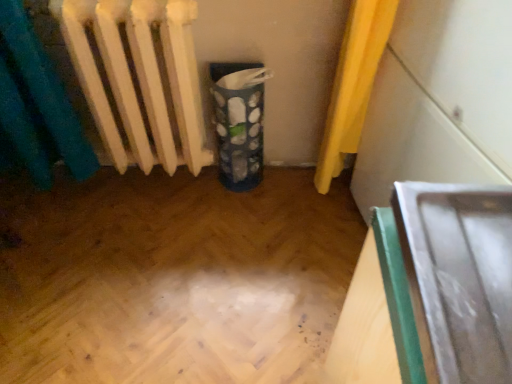
What is the approximate height of blue fabric recycling bin at center?

It is 19.67 inches.

The height and width of the screenshot is (384, 512). I want to click on metallic silver tray at right, which is the 2th wide in left-to-right order, so click(439, 100).

In the scene shown: Would you say blue fabric recycling bin at center is outside metallic silver tray at right, which is the 2th wide in left-to-right order?

Yes, blue fabric recycling bin at center is outside of metallic silver tray at right, which is the 2th wide in left-to-right order.

From a real-world perspective, is blue fabric recycling bin at center positioned over metallic silver tray at right, which is the 2th wide in left-to-right order, based on gravity?

No, from a real-world perspective, blue fabric recycling bin at center is not on top of metallic silver tray at right, which is the 2th wide in left-to-right order.

Is point (251, 82) farther from camera compared to point (480, 75)?

That is True.

Is blue fabric recycling bin at center positioned with its back to metallic silver tray at right, which appears as the 1th wide when viewed from the right?

No, blue fabric recycling bin at center is not facing away from metallic silver tray at right, which appears as the 1th wide when viewed from the right.

From the picture: Is white matte radiator at left wider or thinner than blue fabric recycling bin at center?

In the image, white matte radiator at left appears to be wider than blue fabric recycling bin at center.

Are white matte radiator at left and blue fabric recycling bin at center located far from each other?

No, white matte radiator at left is not far from blue fabric recycling bin at center.

Which object is closer to the camera, white matte radiator at left or blue fabric recycling bin at center?

Positioned in front is white matte radiator at left.

Measure the distance between metallic silver tray at lower right, which is the second wide from right to left, and white matte radiator at left.

metallic silver tray at lower right, which is the second wide from right to left, and white matte radiator at left are 88.28 centimeters apart.

Which is behind, metallic silver tray at lower right, which is the second wide from right to left, or white matte radiator at left?

white matte radiator at left is behind.

Is metallic silver tray at lower right, which is the second wide from right to left, not within white matte radiator at left?

Indeed, metallic silver tray at lower right, which is the second wide from right to left, is completely outside white matte radiator at left.

This screenshot has width=512, height=384. What are the coordinates of `the 2nd wide below when counting from the white matte radiator at left (from the image's perspective)` in the screenshot? It's located at (459, 276).

Is metallic silver tray at right, which appears as the 1th wide when viewed from the right, touching metallic silver tray at lower right, which is the second wide from right to left?

No, metallic silver tray at right, which appears as the 1th wide when viewed from the right, is not in contact with metallic silver tray at lower right, which is the second wide from right to left.

From the image's perspective, which is below, metallic silver tray at right, which appears as the 1th wide when viewed from the right, or metallic silver tray at lower right, which is the second wide from right to left?

metallic silver tray at lower right, which is the second wide from right to left, is shown below in the image.

Does metallic silver tray at right, which is the 2th wide in left-to-right order, have a lesser height compared to metallic silver tray at lower right, which is the first wide from left to right?

No.

Which is nearer, [455,68] or [467,266]?

The point [467,266] is more forward.

Which is in front, point (483, 237) or point (227, 150)?

The point (483, 237) is more forward.

From the image's perspective, which one is positioned lower, metallic silver tray at lower right, which is the second wide from right to left, or blue fabric recycling bin at center?

metallic silver tray at lower right, which is the second wide from right to left, is shown below in the image.

From the picture: Is metallic silver tray at lower right, which is the second wide from right to left, not inside blue fabric recycling bin at center?

Yes, metallic silver tray at lower right, which is the second wide from right to left, is outside of blue fabric recycling bin at center.

Based on the photo, considering the relative sizes of white matte radiator at left and metallic silver tray at lower right, which is the second wide from right to left, in the image provided, is white matte radiator at left shorter than metallic silver tray at lower right, which is the second wide from right to left,?

In fact, white matte radiator at left may be taller than metallic silver tray at lower right, which is the second wide from right to left.

Can you see white matte radiator at left touching metallic silver tray at lower right, which is the first wide from left to right?

There is a gap between white matte radiator at left and metallic silver tray at lower right, which is the first wide from left to right.

Find the location of a particular element. The height and width of the screenshot is (384, 512). radiator that appears below the metallic silver tray at lower right, which is the first wide from left to right (from a real-world perspective) is located at coordinates click(139, 78).

From a real-world perspective, who is located higher, blue fabric recycling bin at center or white matte radiator at left?

white matte radiator at left.

Can you tell me how much blue fabric recycling bin at center and white matte radiator at left differ in facing direction?

2.21 degrees separate the facing orientations of blue fabric recycling bin at center and white matte radiator at left.

Who is bigger, blue fabric recycling bin at center or white matte radiator at left?

Bigger between the two is white matte radiator at left.

I want to click on radiator above the blue fabric recycling bin at center (from the image's perspective), so click(139, 78).

Locate an element on the screen. The image size is (512, 384). the 1st wide in front when counting from the blue fabric recycling bin at center is located at coordinates (439, 100).

The height and width of the screenshot is (384, 512). What are the coordinates of `radiator above the blue fabric recycling bin at center (from the image's perspective)` in the screenshot? It's located at (139, 78).

Which object lies nearer to the anchor point blue fabric recycling bin at center, white matte radiator at left or metallic silver tray at lower right, which is the first wide from left to right?

white matte radiator at left is positioned closer to the anchor blue fabric recycling bin at center.

From the image, which object appears to be farther from metallic silver tray at right, which is the 2th wide in left-to-right order, metallic silver tray at lower right, which is the first wide from left to right, or white matte radiator at left?

white matte radiator at left.

From the image, which object appears to be nearer to white matte radiator at left, blue fabric recycling bin at center or metallic silver tray at lower right, which is the second wide from right to left?

blue fabric recycling bin at center.

When comparing their distances from metallic silver tray at right, which appears as the 1th wide when viewed from the right, does blue fabric recycling bin at center or metallic silver tray at lower right, which is the first wide from left to right, seem further?

metallic silver tray at lower right, which is the first wide from left to right, is further to metallic silver tray at right, which appears as the 1th wide when viewed from the right.

Looking at the image, which one is located further to metallic silver tray at right, which appears as the 1th wide when viewed from the right, white matte radiator at left or metallic silver tray at lower right, which is the first wide from left to right?

Among the two, white matte radiator at left is located further to metallic silver tray at right, which appears as the 1th wide when viewed from the right.

Considering their positions, is metallic silver tray at right, which is the 2th wide in left-to-right order, positioned closer to white matte radiator at left than blue fabric recycling bin at center?

The object closer to white matte radiator at left is blue fabric recycling bin at center.

When comparing their distances from metallic silver tray at lower right, which is the first wide from left to right, does blue fabric recycling bin at center or metallic silver tray at right, which appears as the 1th wide when viewed from the right, seem closer?

metallic silver tray at right, which appears as the 1th wide when viewed from the right, is positioned closer to the anchor metallic silver tray at lower right, which is the first wide from left to right.

Based on their spatial positions, is blue fabric recycling bin at center or metallic silver tray at right, which appears as the 1th wide when viewed from the right, further from white matte radiator at left?

metallic silver tray at right, which appears as the 1th wide when viewed from the right, is further to white matte radiator at left.

The image size is (512, 384). Identify the location of wide situated between white matte radiator at left and metallic silver tray at right, which is the 2th wide in left-to-right order, from left to right. (459, 276).

Where is `recycling bin located between white matte radiator at left and metallic silver tray at right, which is the 2th wide in left-to-right order, in the left-right direction`? recycling bin located between white matte radiator at left and metallic silver tray at right, which is the 2th wide in left-to-right order, in the left-right direction is located at coordinates (239, 122).

Where is `recycling bin between white matte radiator at left and metallic silver tray at lower right, which is the first wide from left to right, in the horizontal direction`? The height and width of the screenshot is (384, 512). recycling bin between white matte radiator at left and metallic silver tray at lower right, which is the first wide from left to right, in the horizontal direction is located at coordinates (239, 122).

Locate an element on the screen. This screenshot has width=512, height=384. wide between metallic silver tray at lower right, which is the first wide from left to right, and blue fabric recycling bin at center in the front-back direction is located at coordinates (439, 100).